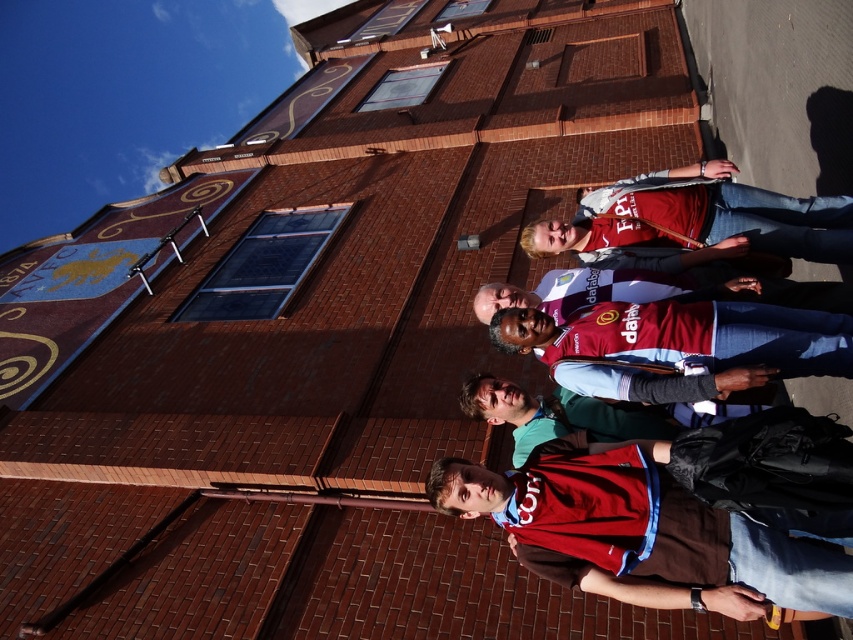
Question: Observing the image, what is the correct spatial positioning of matte red jersey at center in reference to matte red shirt at center?

Choices:
 (A) right
 (B) left

Answer: (B)

Question: Can you confirm if matte red jersey at center is wider than matte red shirt at center?

Choices:
 (A) yes
 (B) no

Answer: (A)

Question: Is matte red jersey at center positioned before matte red shirt at center?

Choices:
 (A) yes
 (B) no

Answer: (A)

Question: Which point is closer to the camera?

Choices:
 (A) matte red jersey at center
 (B) matte red shirt at center

Answer: (A)